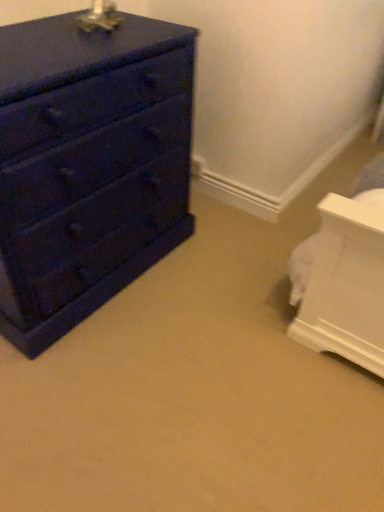
Find the location of `matte dark blue dresser at left`. matte dark blue dresser at left is located at coordinates (88, 166).

This screenshot has height=512, width=384. Describe the element at coordinates (88, 166) in the screenshot. I see `matte dark blue dresser at left` at that location.

You are a GUI agent. You are given a task and a screenshot of the screen. Output one action in this format:
    pyautogui.click(x=<x>, y=<y>)
    Task: Click on the matte dark blue dresser at left
    The height and width of the screenshot is (512, 384).
    Given the screenshot: What is the action you would take?
    pyautogui.click(x=88, y=166)